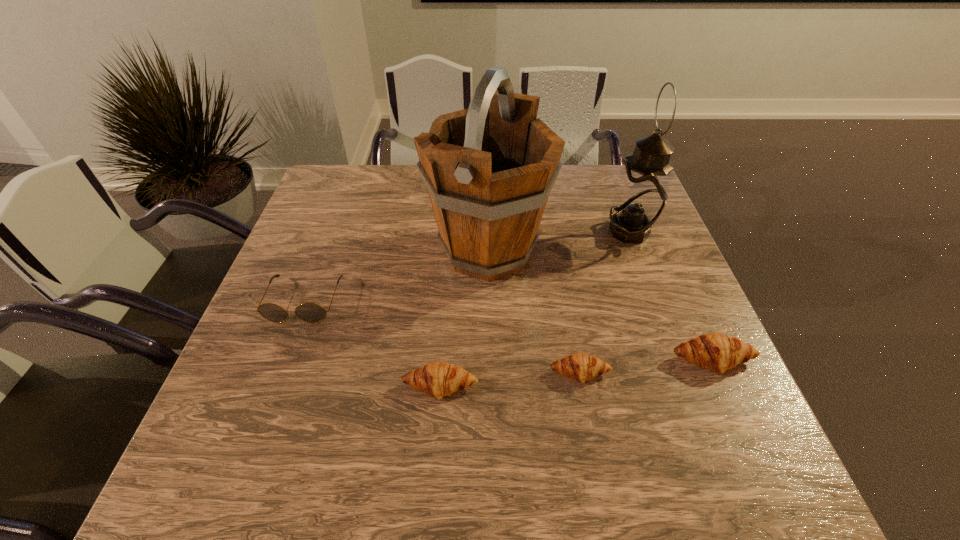
Identify the location of the leftmost pastry. (438, 379).

Find the location of `the second shortest pastry`. the second shortest pastry is located at coordinates (438, 379).

At what (x,y) coordinates should I click in order to perform the action: click on the shortest object. Please return your answer as a coordinate pair (x, y). This screenshot has height=540, width=960. Looking at the image, I should click on 581,367.

You are a GUI agent. You are given a task and a screenshot of the screen. Output one action in this format:
    pyautogui.click(x=<x>, y=<y>)
    Task: Click on the second pastry from right to left
    
    Given the screenshot: What is the action you would take?
    pyautogui.click(x=581, y=367)

Locate an element on the screen. This screenshot has width=960, height=540. the rightmost pastry is located at coordinates (717, 352).

At what (x,y) coordinates should I click in order to perform the action: click on oil lamp. Please return your answer as a coordinate pair (x, y). The image size is (960, 540). Looking at the image, I should click on (640, 196).

Find the location of a particular element. This screenshot has width=960, height=540. bucket is located at coordinates (489, 169).

Identify the location of the leftmost object. This screenshot has width=960, height=540. (308, 312).

This screenshot has height=540, width=960. Identify the location of free spot located on the front-facing side of the shortest object. (588, 414).

You are a GUI agent. You are given a task and a screenshot of the screen. Output one action in this format:
    pyautogui.click(x=<x>, y=<y>)
    Task: Click on the blank space located 0.060m on the front-facing side of the rightmost pastry
    The image size is (960, 540).
    Given the screenshot: What is the action you would take?
    pyautogui.click(x=732, y=405)